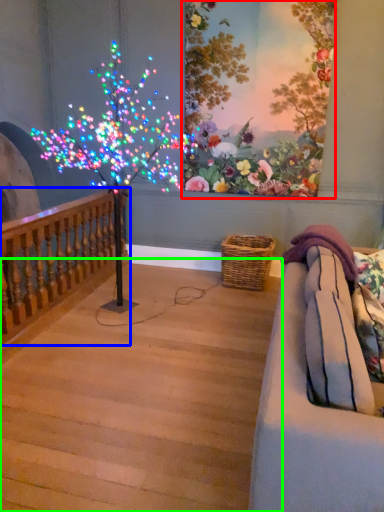
Question: Estimate the real-world distances between objects in this image. Which object is closer to floral arrangement (highlighted by a red box), rail (highlighted by a blue box) or stairwell (highlighted by a green box)?

Choices:
 (A) rail
 (B) stairwell

Answer: (A)